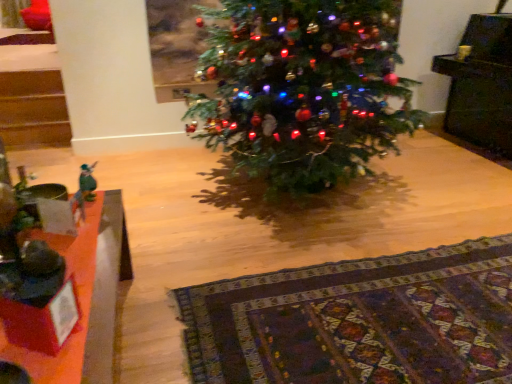
This screenshot has height=384, width=512. What do you see at coordinates (304, 88) in the screenshot?
I see `green matte christmas tree at center` at bounding box center [304, 88].

The height and width of the screenshot is (384, 512). I want to click on patterned wool rug at lower center, so click(358, 321).

From the image's perspective, is wooden table at lower left on top of green felt angel at left?

No.

Does point (96, 326) lie behind point (92, 188)?

No.

How distant is wooden table at lower left from green felt angel at left?

They are 17.35 inches apart.

Is wooden table at lower left further to the viewer compared to green felt angel at left?

No.

Who is smaller, wooden table at lower left or patterned wool rug at lower center?

Smaller between the two is patterned wool rug at lower center.

Considering the sizes of objects wooden table at lower left and patterned wool rug at lower center in the image provided, who is taller, wooden table at lower left or patterned wool rug at lower center?

wooden table at lower left.

From the image's perspective, who appears lower, wooden table at lower left or patterned wool rug at lower center?

patterned wool rug at lower center.

Is green felt angel at left looking in the opposite direction of patterned wool rug at lower center?

That's not correct — green felt angel at left is not looking away from patterned wool rug at lower center.

How many degrees apart are the facing directions of green felt angel at left and patterned wool rug at lower center?

There is a 177-degree angle between the facing directions of green felt angel at left and patterned wool rug at lower center.

Does green felt angel at left have a greater width compared to patterned wool rug at lower center?

No, green felt angel at left is not wider than patterned wool rug at lower center.

From the image's perspective, is green felt angel at left above patterned wool rug at lower center?

Indeed, from the image's perspective, green felt angel at left is shown above patterned wool rug at lower center.

In the scene shown: Is green felt angel at left wider than wooden table at lower left?

Incorrect, the width of green felt angel at left does not surpass that of wooden table at lower left.

Can you confirm if green felt angel at left is bigger than wooden table at lower left?

No.

Consider the image. In the image, is green felt angel at left on the left side or the right side of wooden table at lower left?

From the image, it's evident that green felt angel at left is to the right of wooden table at lower left.

In the image, there is a wooden table at lower left. In order to click on toy above it (from the image's perspective) in this screenshot , I will do pos(87,182).

From the image's perspective, is green matte christmas tree at center under patterned wool rug at lower center?

No.

Based on the photo, can you confirm if green matte christmas tree at center is taller than patterned wool rug at lower center?

Yes, green matte christmas tree at center is taller than patterned wool rug at lower center.

Find the location of a particular element. christmas tree located above the patterned wool rug at lower center (from the image's perspective) is located at coordinates 304,88.

Could you tell me if green matte christmas tree at center is turned towards patterned wool rug at lower center?

Yes.

Is green matte christmas tree at center positioned behind wooden table at lower left?

That is True.

At what (x,y) coordinates should I click in order to perform the action: click on table in front of the green matte christmas tree at center. Please return your answer as a coordinate pair (x, y). The image size is (512, 384). Looking at the image, I should click on (83, 299).

From the image's perspective, is green matte christmas tree at center on top of wooden table at lower left?

Yes, from the image's perspective, green matte christmas tree at center is above wooden table at lower left.

Would you say green matte christmas tree at center is inside or outside wooden table at lower left?

green matte christmas tree at center lies outside wooden table at lower left.

At what (x,y) coordinates should I click in order to perform the action: click on blanket in front of the green matte christmas tree at center. Please return your answer as a coordinate pair (x, y). The height and width of the screenshot is (384, 512). Looking at the image, I should click on (358, 321).

From the image's perspective, which one is positioned lower, patterned wool rug at lower center or green matte christmas tree at center?

patterned wool rug at lower center, from the image's perspective.

Considering their positions, is patterned wool rug at lower center located in front of or behind green matte christmas tree at center?

Clearly, patterned wool rug at lower center is in front of green matte christmas tree at center.

Is patterned wool rug at lower center not close to green matte christmas tree at center?

No, patterned wool rug at lower center is not far from green matte christmas tree at center.

Locate an element on the screen. toy that appears above the wooden table at lower left (from the image's perspective) is located at coordinates (87, 182).

At what (x,y) coordinates should I click in order to perform the action: click on blanket that appears below the wooden table at lower left (from the image's perspective). Please return your answer as a coordinate pair (x, y). The width and height of the screenshot is (512, 384). Looking at the image, I should click on (358, 321).

Considering their positions, is patterned wool rug at lower center positioned further to green matte christmas tree at center than green felt angel at left?

Based on the image, green felt angel at left appears to be further to green matte christmas tree at center.

From the image, which object appears to be farther from green felt angel at left, patterned wool rug at lower center or green matte christmas tree at center?

The object further to green felt angel at left is green matte christmas tree at center.

In the scene shown: From the image, which object appears to be farther from patterned wool rug at lower center, wooden table at lower left or green felt angel at left?

green felt angel at left lies further to patterned wool rug at lower center than the other object.

Which object lies nearer to the anchor point wooden table at lower left, patterned wool rug at lower center or green matte christmas tree at center?

Among the two, patterned wool rug at lower center is located nearer to wooden table at lower left.

Based on the photo, looking at the image, which one is located closer to green matte christmas tree at center, patterned wool rug at lower center or wooden table at lower left?

patterned wool rug at lower center is closer to green matte christmas tree at center.

Which object lies further to the anchor point wooden table at lower left, green felt angel at left or green matte christmas tree at center?

green matte christmas tree at center is further to wooden table at lower left.

Considering their positions, is green felt angel at left positioned further to patterned wool rug at lower center than wooden table at lower left?

The object further to patterned wool rug at lower center is green felt angel at left.

Based on their spatial positions, is green felt angel at left or wooden table at lower left further from green matte christmas tree at center?

green felt angel at left is further to green matte christmas tree at center.

Find the location of a particular element. The image size is (512, 384). christmas tree situated between wooden table at lower left and patterned wool rug at lower center from left to right is located at coordinates (304, 88).

I want to click on toy between wooden table at lower left and patterned wool rug at lower center from left to right, so click(x=87, y=182).

You are a GUI agent. You are given a task and a screenshot of the screen. Output one action in this format:
    pyautogui.click(x=<x>, y=<y>)
    Task: Click on the christmas tree located between green felt angel at left and patterned wool rug at lower center in the left-right direction
    The image size is (512, 384).
    Given the screenshot: What is the action you would take?
    pyautogui.click(x=304, y=88)

The height and width of the screenshot is (384, 512). Find the location of `toy between green matte christmas tree at center and wooden table at lower left from top to bottom`. toy between green matte christmas tree at center and wooden table at lower left from top to bottom is located at coordinates (87, 182).